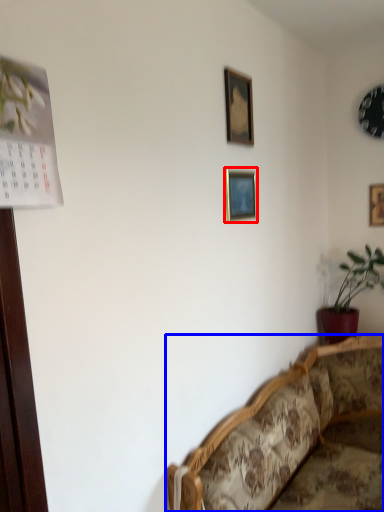
Question: Which point is closer to the camera, picture frame (highlighted by a red box) or studio couch (highlighted by a blue box)?

Choices:
 (A) picture frame
 (B) studio couch

Answer: (B)